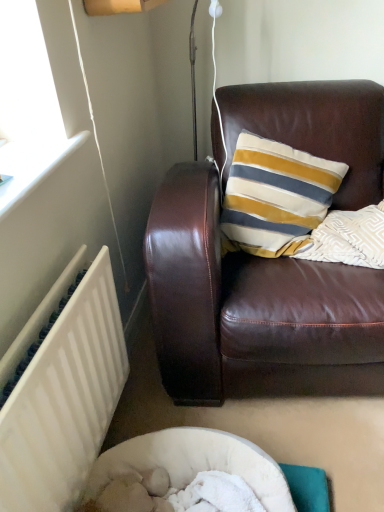
Question: Is brown leather couch at upper right positioned in front of white painted radiator at lower left?

Choices:
 (A) yes
 (B) no

Answer: (B)

Question: Is brown leather couch at upper right facing towards white painted radiator at lower left?

Choices:
 (A) yes
 (B) no

Answer: (B)

Question: Is brown leather couch at upper right facing away from white painted radiator at lower left?

Choices:
 (A) no
 (B) yes

Answer: (A)

Question: Considering the relative positions of brown leather couch at upper right and white painted radiator at lower left in the image provided, is brown leather couch at upper right to the right of white painted radiator at lower left from the viewer's perspective?

Choices:
 (A) yes
 (B) no

Answer: (A)

Question: From the image's perspective, does brown leather couch at upper right appear lower than white painted radiator at lower left?

Choices:
 (A) yes
 (B) no

Answer: (B)

Question: Is brown leather couch at upper right bigger than white painted radiator at lower left?

Choices:
 (A) yes
 (B) no

Answer: (A)

Question: From a real-world perspective, is white painted radiator at lower left physically below brown leather couch at upper right?

Choices:
 (A) no
 (B) yes

Answer: (B)

Question: From a real-world perspective, is white painted radiator at lower left located higher than brown leather couch at upper right?

Choices:
 (A) yes
 (B) no

Answer: (B)

Question: Is the position of white painted radiator at lower left less distant than that of brown leather couch at upper right?

Choices:
 (A) no
 (B) yes

Answer: (B)

Question: Does white painted radiator at lower left have a larger size compared to brown leather couch at upper right?

Choices:
 (A) yes
 (B) no

Answer: (B)

Question: Is white painted radiator at lower left further to camera compared to brown leather couch at upper right?

Choices:
 (A) yes
 (B) no

Answer: (B)

Question: Is brown leather couch at upper right completely or partially inside white painted radiator at lower left?

Choices:
 (A) yes
 (B) no

Answer: (B)

Question: From a real-world perspective, is white painted radiator at lower left physically located above or below brown leather couch at upper right?

Choices:
 (A) below
 (B) above

Answer: (A)